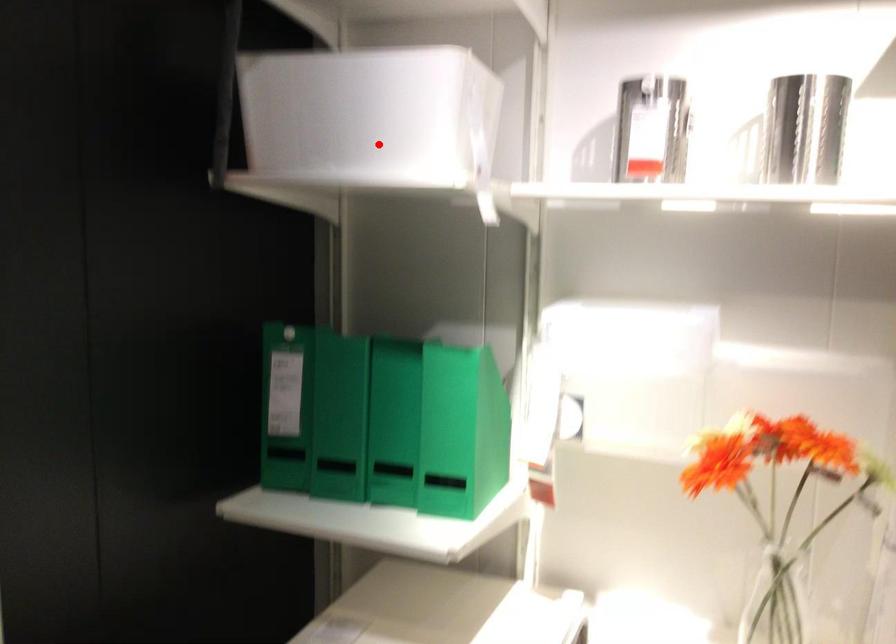
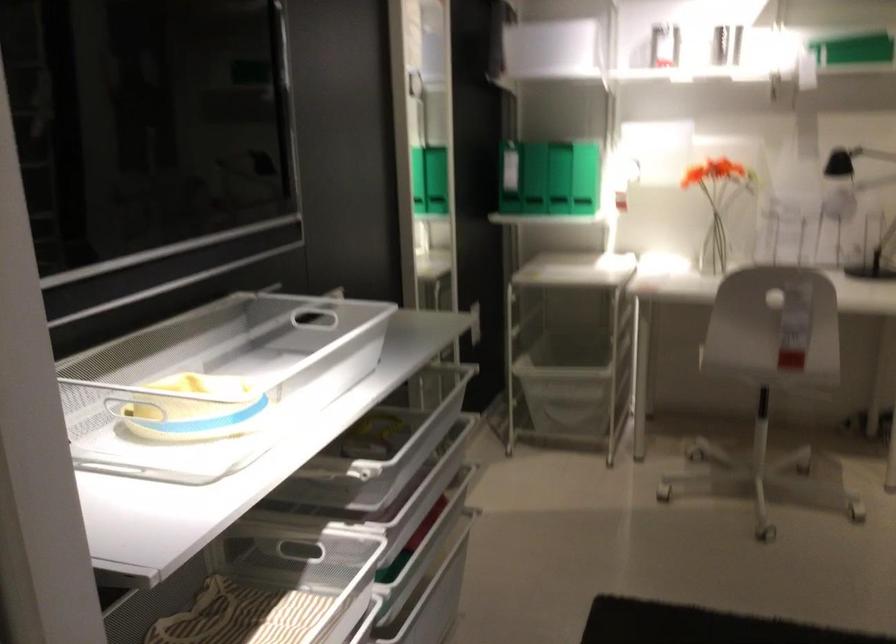
Question: I am providing you with two images of the same scene from different viewpoints. Given a red point in image1, look at the same physical point in image2. Is it:

Choices:
 (A) Closer to the viewpoint
 (B) Farther from the viewpoint

Answer: (B)